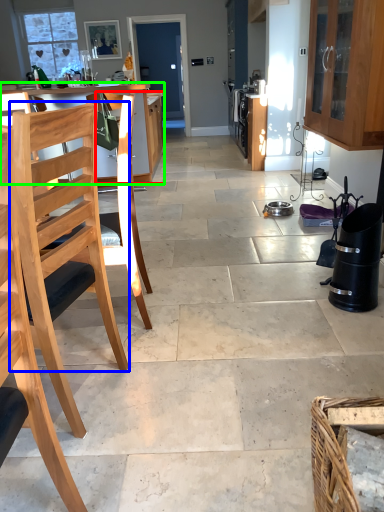
Question: Which is nearer to the cabinetry (highlighted by a red box)? chair (highlighted by a blue box) or table (highlighted by a green box).

Choices:
 (A) chair
 (B) table

Answer: (B)